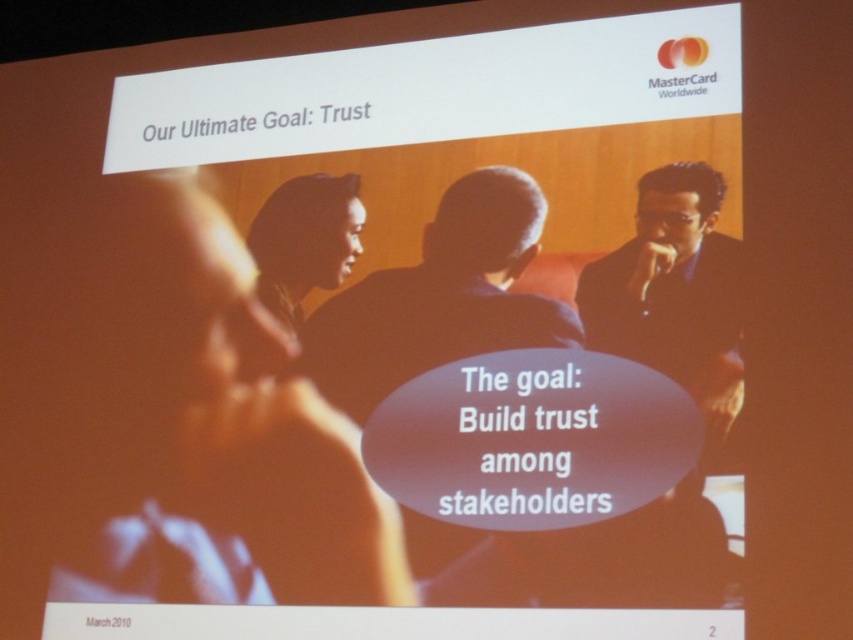
Question: Which point is farther to the camera?

Choices:
 (A) (343, 266)
 (B) (675, 339)
 (C) (444, 342)
 (D) (293, 490)

Answer: (A)

Question: Which object is the farthest from the black glossy suit at right?

Choices:
 (A) dark blue suit at center
 (B) dark skin smooth face at center

Answer: (B)

Question: Is the position of smooth skin face at center less distant than that of dark blue suit at center?

Choices:
 (A) yes
 (B) no

Answer: (A)

Question: Observing the image, what is the correct spatial positioning of dark blue suit at center in reference to black glossy suit at right?

Choices:
 (A) right
 (B) left

Answer: (B)

Question: Which point appears closest to the camera in this image?

Choices:
 (A) (721, 406)
 (B) (457, 324)
 (C) (68, 556)
 (D) (268, 248)

Answer: (A)

Question: Does dark blue suit at center appear under black glossy suit at right?

Choices:
 (A) yes
 (B) no

Answer: (A)